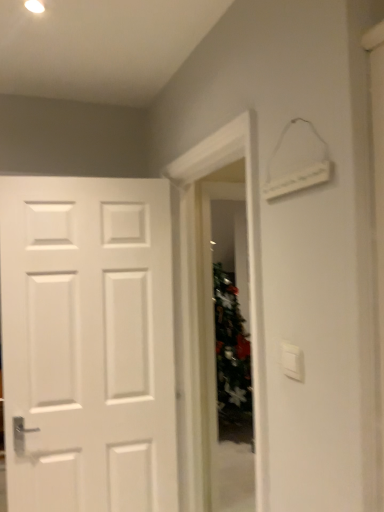
Question: Is green frosted glass door at center far from white plastic light switch at upper right?

Choices:
 (A) yes
 (B) no

Answer: (A)

Question: From a real-world perspective, is green frosted glass door at center positioned under white plastic light switch at upper right based on gravity?

Choices:
 (A) yes
 (B) no

Answer: (A)

Question: Could you tell me if green frosted glass door at center is facing white plastic light switch at upper right?

Choices:
 (A) no
 (B) yes

Answer: (A)

Question: Is green frosted glass door at center in front of white plastic light switch at upper right?

Choices:
 (A) yes
 (B) no

Answer: (B)

Question: Is the depth of green frosted glass door at center greater than that of white plastic light switch at upper right?

Choices:
 (A) no
 (B) yes

Answer: (B)

Question: Is green frosted glass door at center thinner than white plastic light switch at upper right?

Choices:
 (A) yes
 (B) no

Answer: (B)

Question: Would you say white plastic light switch at upper right is outside green frosted glass door at center?

Choices:
 (A) yes
 (B) no

Answer: (A)

Question: Could green frosted glass door at center be considered to be inside white plastic light switch at upper right?

Choices:
 (A) no
 (B) yes

Answer: (A)

Question: Does white plastic light switch at upper right touch green frosted glass door at center?

Choices:
 (A) yes
 (B) no

Answer: (B)

Question: Does white plastic light switch at upper right come in front of green frosted glass door at center?

Choices:
 (A) yes
 (B) no

Answer: (A)

Question: From the image's perspective, is white plastic light switch at upper right located beneath green frosted glass door at center?

Choices:
 (A) yes
 (B) no

Answer: (B)

Question: From a real-world perspective, is white plastic light switch at upper right on green frosted glass door at center?

Choices:
 (A) yes
 (B) no

Answer: (A)

Question: Considering the positions of white plastic light switch at upper right and green frosted glass door at center in the image, is white plastic light switch at upper right wider or thinner than green frosted glass door at center?

Choices:
 (A) thin
 (B) wide

Answer: (A)